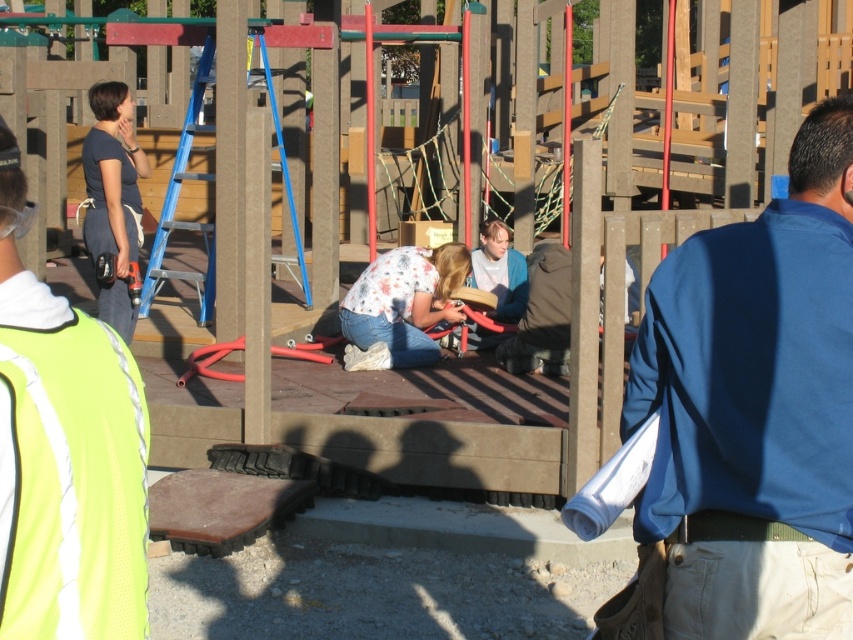
Question: Does blue fabric shirt at center appear on the left side of neon yellow mesh safety vest at left?

Choices:
 (A) no
 (B) yes

Answer: (A)

Question: Which of the following is the closest to the observer?

Choices:
 (A) dark blue shirt at left
 (B) neon yellow mesh safety vest at left
 (C) blue fabric shirt at center

Answer: (B)

Question: Which point is closer to the camera taking this photo?

Choices:
 (A) (141, 636)
 (B) (720, 333)
 (C) (408, 289)

Answer: (A)

Question: Is dark blue shirt at left thinner than floral fabric shirt at center?

Choices:
 (A) yes
 (B) no

Answer: (A)

Question: Which object appears closest to the camera in this image?

Choices:
 (A) dark blue shirt at left
 (B) neon yellow mesh safety vest at left
 (C) blue fabric shirt at center
 (D) floral fabric shirt at center

Answer: (B)

Question: Does blue fabric shirt at center appear on the right side of neon yellow mesh safety vest at left?

Choices:
 (A) yes
 (B) no

Answer: (A)